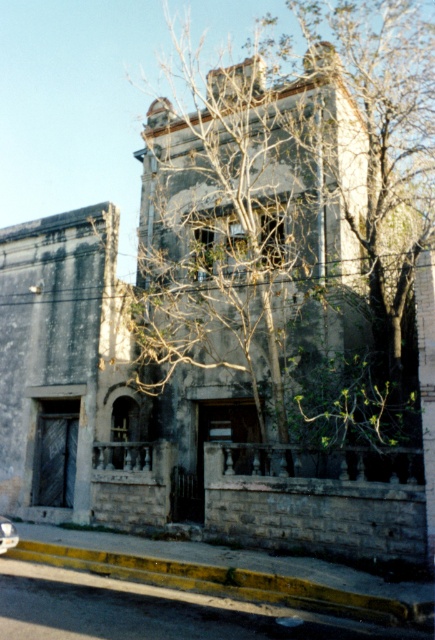
You are standing on the sidewalk in front of the old building and want to walk towards the building. Which point, point (285, 124) or point (268, 579), is closer to you as you approach the building?

Point (285, 124) is closer to you because it is further to the viewer than point (268, 579), meaning it is nearer in the scene.

You are a pedestrian walking along the sidewalk in front of the old building. You notice the bare branches at center and the yellow painted concrete curb at lower center. Which object is positioned to the right side from your perspective?

The bare branches at center are to the right of the yellow painted concrete curb at lower center, so the bare branches at center are positioned to the right side from your perspective.